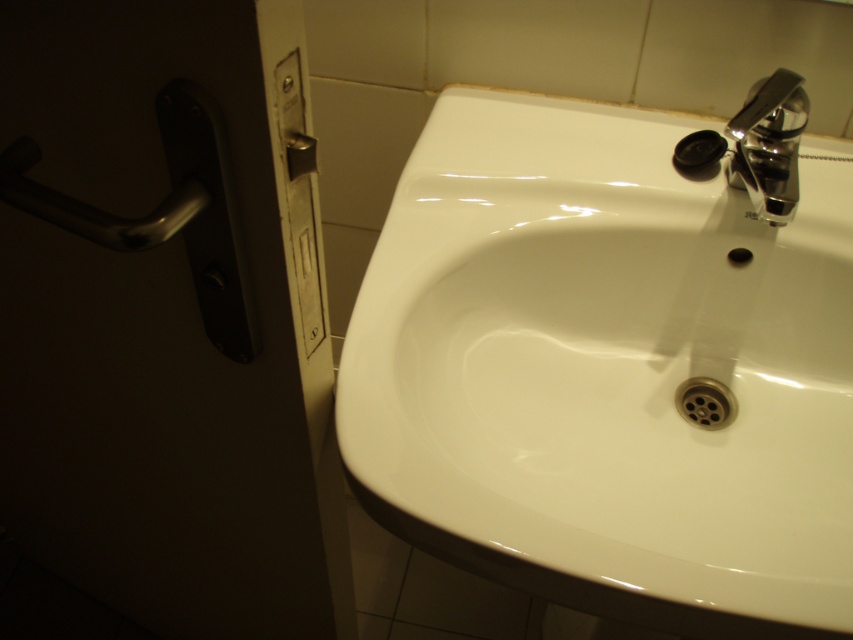
Does white glossy sink at center appear over polished metal door handle at left?

Actually, white glossy sink at center is below polished metal door handle at left.

Measure the distance between white glossy sink at center and camera.

The distance of white glossy sink at center from camera is 18.75 inches.

Does point (688, 445) come farther from viewer compared to point (241, 252)?

Yes.

Find the location of `white glossy sink at center`. white glossy sink at center is located at coordinates (607, 371).

Is point (137, 218) positioned in front of point (761, 84)?

Yes, point (137, 218) is in front of point (761, 84).

Between point (61, 224) and point (740, 173), which one is positioned in front?

Point (61, 224)

Locate an element on the screen. This screenshot has height=640, width=853. polished metal door handle at left is located at coordinates (167, 212).

Which is above, white glossy sink at center or polished chrome faucet at upper right?

Positioned higher is polished chrome faucet at upper right.

Does white glossy sink at center appear on the right side of polished chrome faucet at upper right?

In fact, white glossy sink at center is to the left of polished chrome faucet at upper right.

Is point (496, 160) less distant than point (753, 113)?

That is False.

At what (x,y) coordinates should I click in order to perform the action: click on white glossy sink at center. Please return your answer as a coordinate pair (x, y). The image size is (853, 640). Looking at the image, I should click on (607, 371).